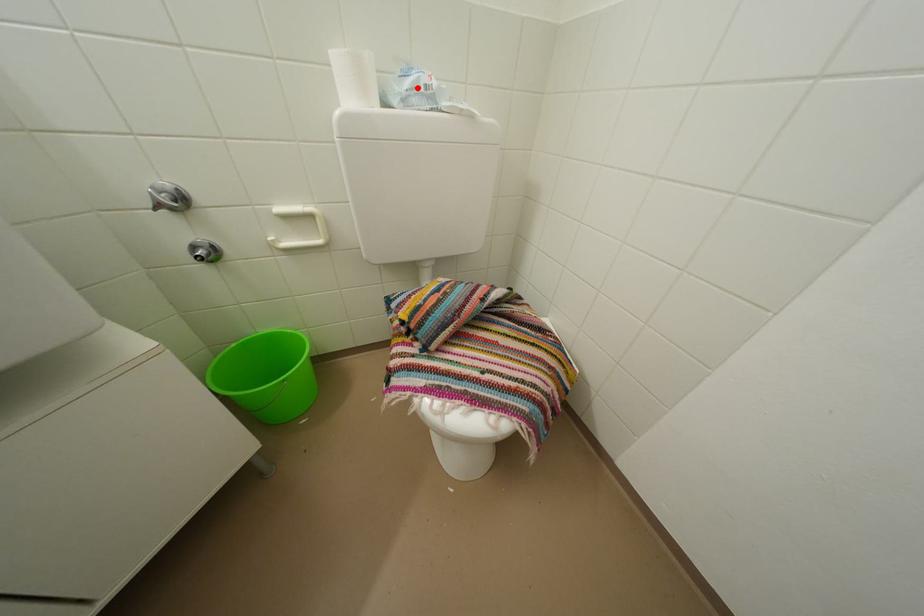
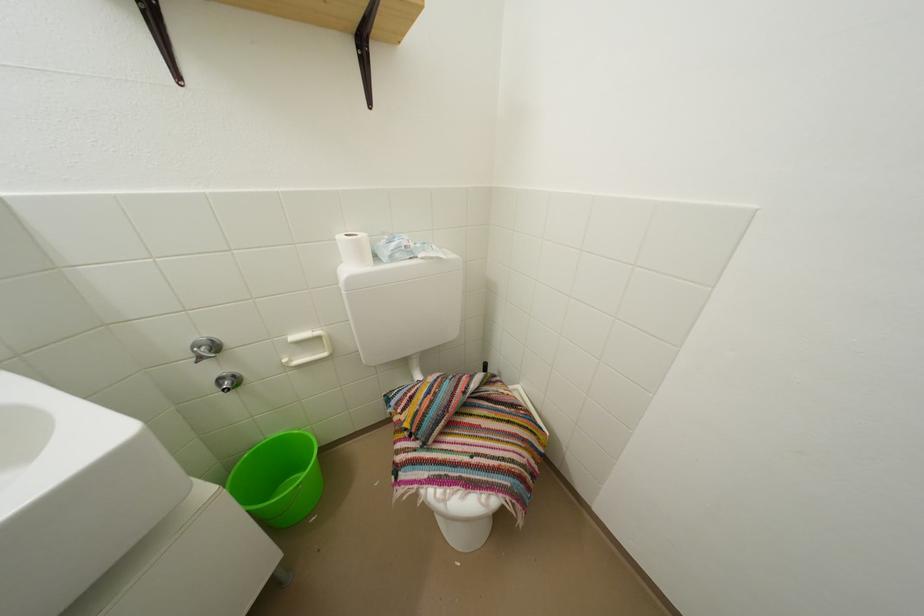
In the second image, find the point that corresponds to the highlighted location in the first image.

(402, 251)